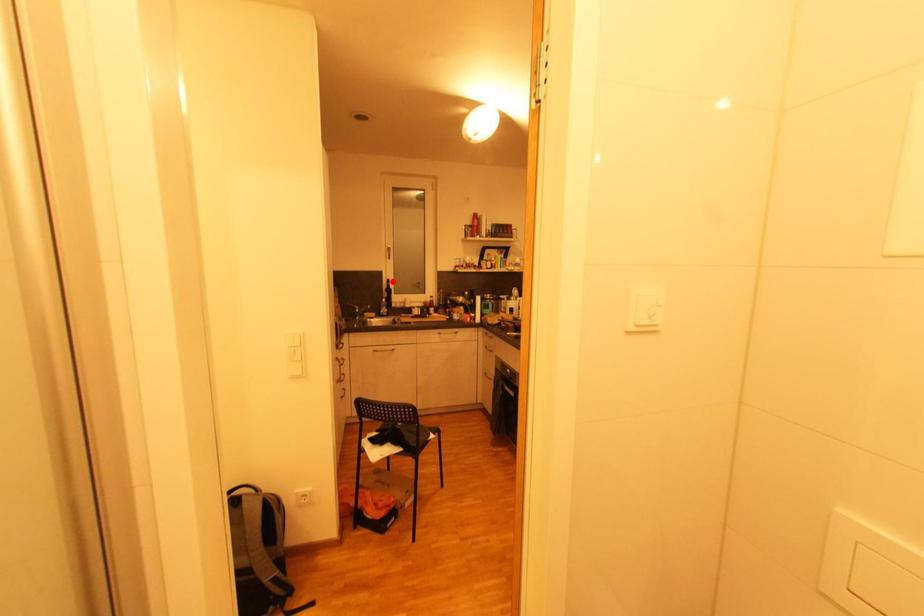
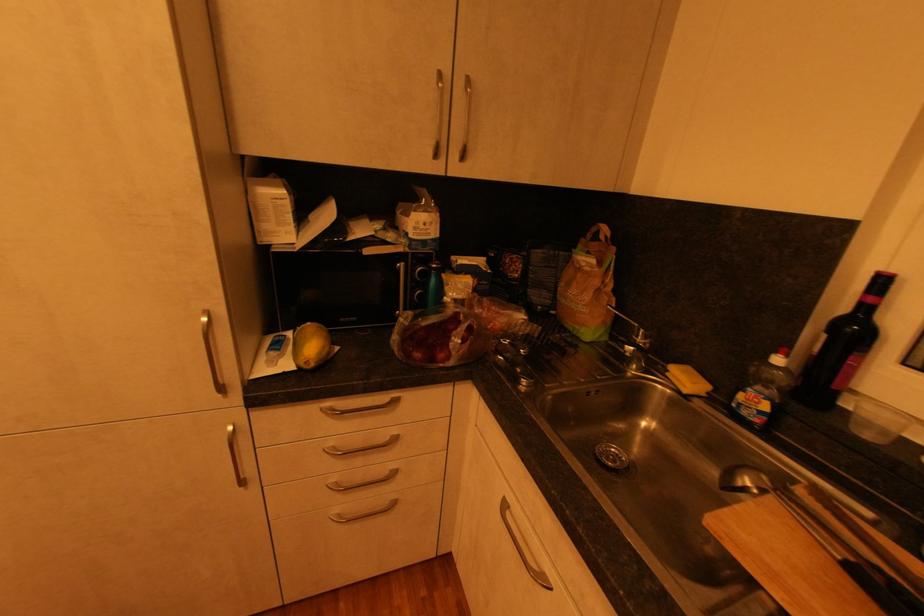
The point at the highlighted location is marked in the first image. Where is the corresponding point in the second image?

(889, 282)